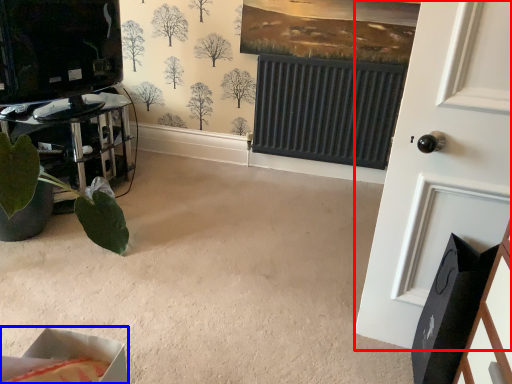
Question: Which point is further to the camera, door (highlighted by a red box) or cardboard box (highlighted by a blue box)?

Choices:
 (A) door
 (B) cardboard box

Answer: (A)